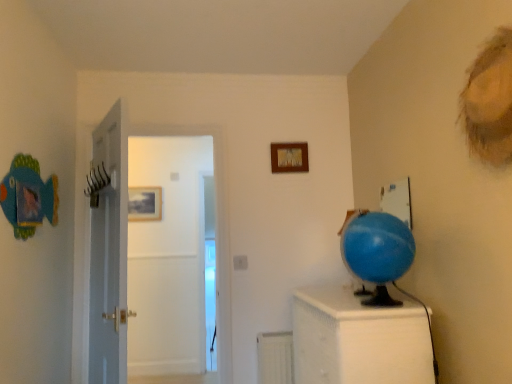
Question: From a real-world perspective, is white textured cabinet at right under wooden picture frame at upper center, which appears as the first picture frame when viewed from the right?

Choices:
 (A) yes
 (B) no

Answer: (A)

Question: From the image's perspective, would you say white textured cabinet at right is shown under wooden picture frame at upper center, which ranks as the first picture frame in front-to-back order?

Choices:
 (A) yes
 (B) no

Answer: (A)

Question: Considering the relative sizes of white textured cabinet at right and wooden picture frame at upper center, which appears as the 2th picture frame when ordered from the bottom, in the image provided, is white textured cabinet at right wider than wooden picture frame at upper center, which appears as the 2th picture frame when ordered from the bottom,?

Choices:
 (A) yes
 (B) no

Answer: (A)

Question: Are white textured cabinet at right and wooden picture frame at upper center, the 1th picture frame viewed from the top, making contact?

Choices:
 (A) yes
 (B) no

Answer: (B)

Question: Does white textured cabinet at right have a lesser height compared to wooden picture frame at upper center, which appears as the first picture frame when viewed from the right?

Choices:
 (A) yes
 (B) no

Answer: (B)

Question: Is white glossy door at center in front of or behind blue rubber globe at right in the image?

Choices:
 (A) front
 (B) behind

Answer: (B)

Question: Based on their sizes in the image, would you say white glossy door at center is bigger or smaller than blue rubber globe at right?

Choices:
 (A) small
 (B) big

Answer: (B)

Question: From the image's perspective, is white glossy door at center above or below blue rubber globe at right?

Choices:
 (A) above
 (B) below

Answer: (B)

Question: In terms of height, does white glossy door at center look taller or shorter compared to blue rubber globe at right?

Choices:
 (A) short
 (B) tall

Answer: (B)

Question: In terms of height, does wooden picture frame at upper center, which appears as the 2th picture frame when ordered from the bottom, look taller or shorter compared to white matte radiator at lower center?

Choices:
 (A) tall
 (B) short

Answer: (B)

Question: In terms of size, does wooden picture frame at upper center, which appears as the first picture frame when viewed from the right, appear bigger or smaller than white matte radiator at lower center?

Choices:
 (A) small
 (B) big

Answer: (A)

Question: Considering the relative positions of wooden picture frame at upper center, which appears as the 2th picture frame when ordered from the bottom, and white matte radiator at lower center in the image provided, is wooden picture frame at upper center, which appears as the 2th picture frame when ordered from the bottom, to the left or to the right of white matte radiator at lower center?

Choices:
 (A) left
 (B) right

Answer: (B)

Question: Is wooden picture frame at upper center, acting as the second picture frame starting from the back, spatially inside white matte radiator at lower center, or outside of it?

Choices:
 (A) outside
 (B) inside

Answer: (A)

Question: In terms of size, does blue rubber globe at right appear bigger or smaller than white glossy door at center?

Choices:
 (A) small
 (B) big

Answer: (A)

Question: Considering their positions, is blue rubber globe at right located in front of or behind white glossy door at center?

Choices:
 (A) behind
 (B) front

Answer: (B)